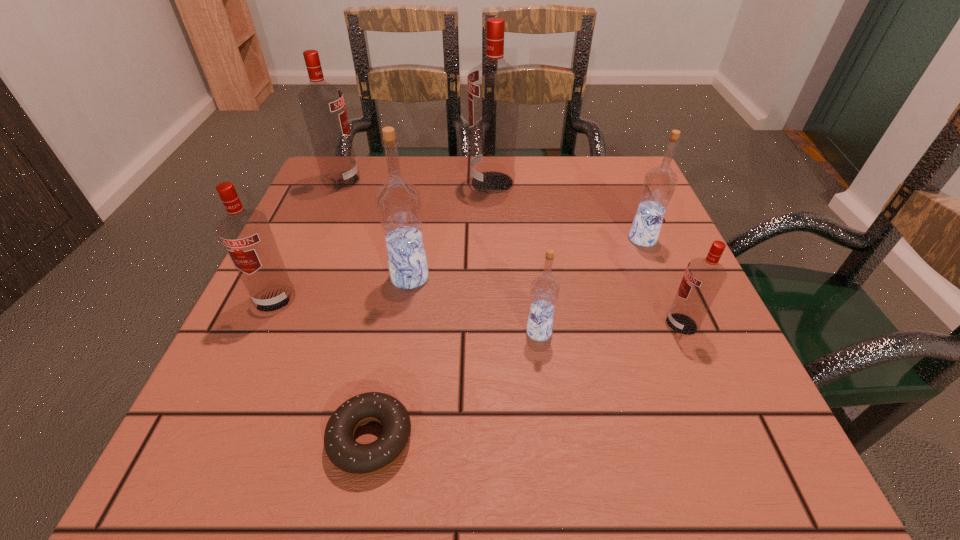
Find the location of a particular element. This screenshot has width=960, height=540. the tallest object is located at coordinates (494, 86).

The image size is (960, 540). I want to click on the biggest red vodka, so click(494, 86).

Where is `the second biggest red vodka`? the second biggest red vodka is located at coordinates (322, 104).

Where is `the fifth vodka from right to left`? This screenshot has height=540, width=960. the fifth vodka from right to left is located at coordinates (398, 202).

Identify the location of the leftmost blue vodka. (398, 202).

This screenshot has height=540, width=960. I want to click on the sixth nearest object, so [659, 184].

You are a GUI agent. You are given a task and a screenshot of the screen. Output one action in this format:
    pyautogui.click(x=<x>, y=<y>)
    Task: Click on the rightmost blue vodka
    The width and height of the screenshot is (960, 540).
    Given the screenshot: What is the action you would take?
    pyautogui.click(x=659, y=184)

The image size is (960, 540). I want to click on the second smallest red vodka, so click(246, 235).

The width and height of the screenshot is (960, 540). In order to click on the smallest red vodka in this screenshot , I will do `click(703, 278)`.

This screenshot has height=540, width=960. Identify the location of the second blue vodka from right to left. (544, 291).